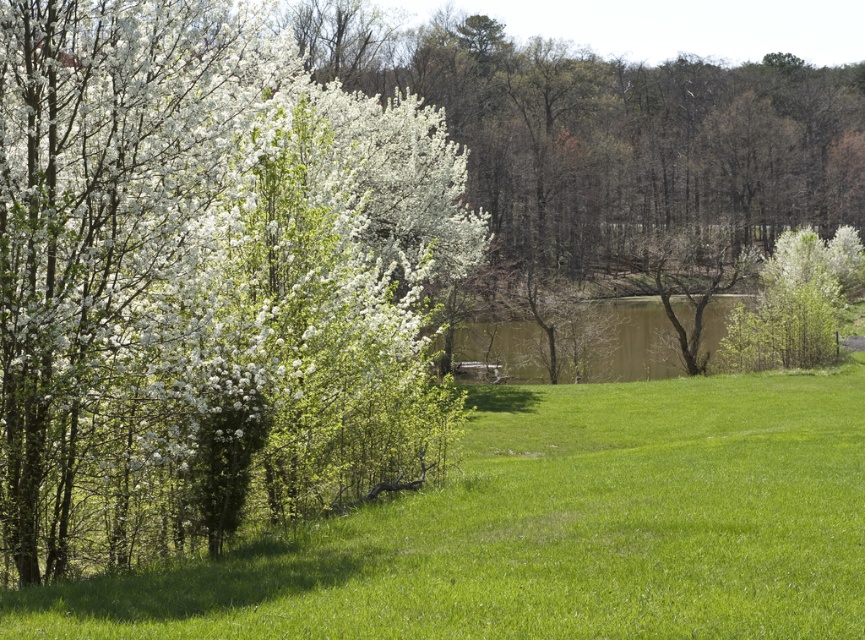
You are planning to take a photo of the white matte flowers at left and the brown matte lake at center. If you want to capture both in the same frame, which object should you focus on to ensure both are visible?

You should focus on the brown matte lake at center because the white matte flowers at left are smaller in width compared to the brown matte lake at center, allowing both to fit within the frame when centered on the larger object.